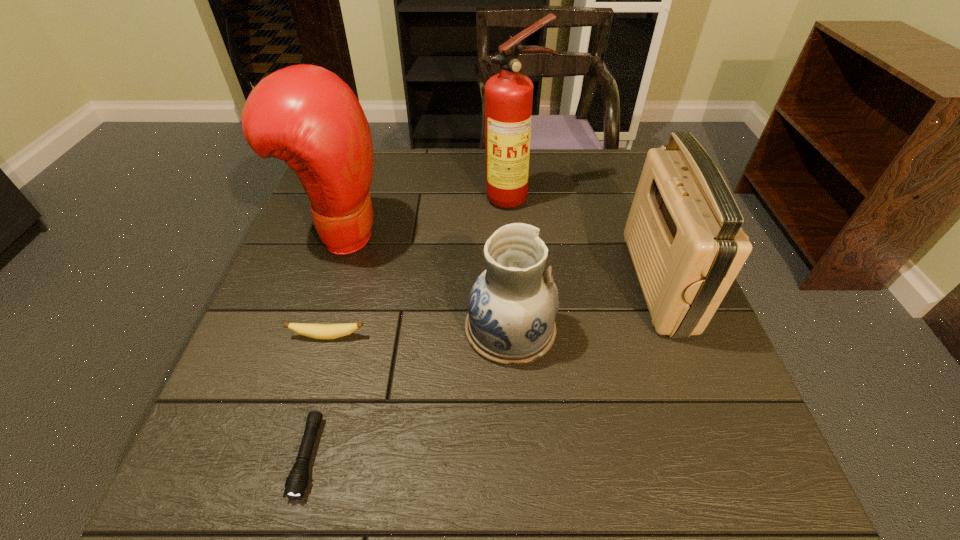
The height and width of the screenshot is (540, 960). I want to click on fire extinguisher, so click(x=508, y=95).

The width and height of the screenshot is (960, 540). What are the coordinates of `boxing glove` in the screenshot? It's located at (307, 116).

Find the location of a particular element. radio receiver is located at coordinates (683, 232).

I want to click on the rightmost object, so click(683, 232).

Locate an element on the screen. The width and height of the screenshot is (960, 540). pottery is located at coordinates (512, 305).

Locate an element on the screen. This screenshot has width=960, height=540. banana is located at coordinates (317, 331).

This screenshot has width=960, height=540. I want to click on flashlight, so click(297, 481).

Find the location of a particular element. This screenshot has height=540, width=960. the shortest object is located at coordinates (297, 481).

Where is `vacant position located on the front-facing side of the fire extinguisher`? The image size is (960, 540). vacant position located on the front-facing side of the fire extinguisher is located at coordinates (517, 241).

Identify the location of vacant space located 0.170m on the striking surface of the boxing glove. (457, 234).